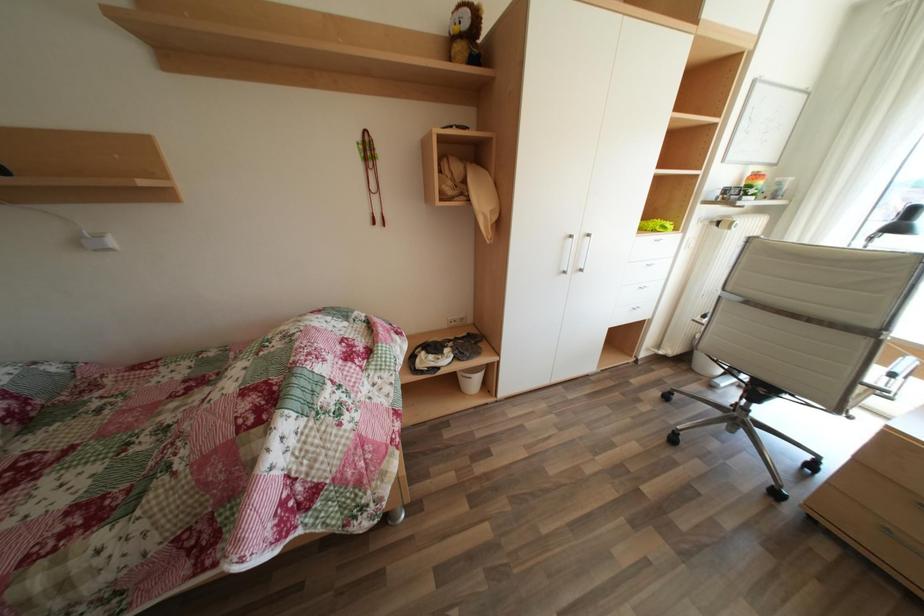
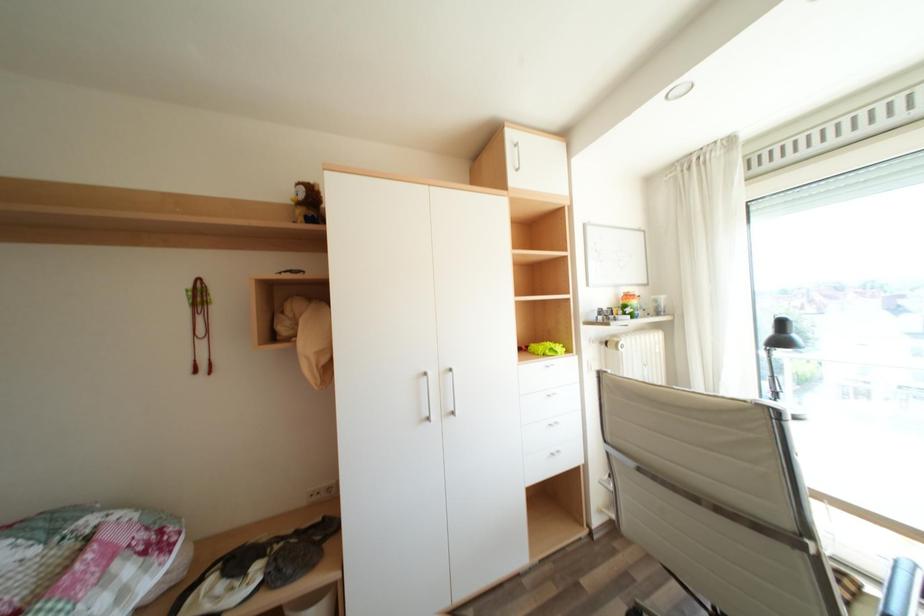
Question: Which direction would the cameraman need to move to produce the second image? Reply with the corresponding letter.

Choices:
 (A) Left
 (B) Right
 (C) Forward
 (D) Backward

Answer: (B)